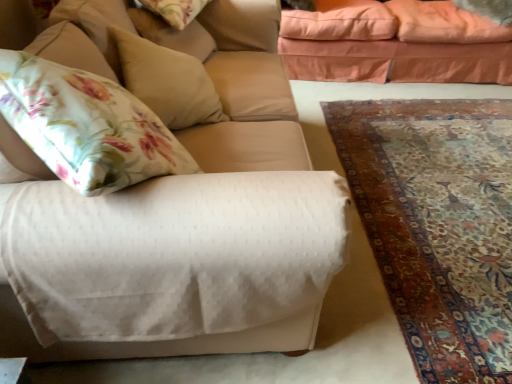
Question: Is floral fabric pillow at upper left, the 3th pillow when ordered from right to left, looking in the opposite direction of fluffy beige pillow at upper right, the first pillow viewed from the top?

Choices:
 (A) yes
 (B) no

Answer: (B)

Question: Considering the relative positions of floral fabric pillow at upper left, which appears as the 1th pillow when viewed from the left, and fluffy beige pillow at upper right, the first pillow viewed from the top, in the image provided, is floral fabric pillow at upper left, which appears as the 1th pillow when viewed from the left, to the left of fluffy beige pillow at upper right, the first pillow viewed from the top, from the viewer's perspective?

Choices:
 (A) no
 (B) yes

Answer: (B)

Question: From the image's perspective, is floral fabric pillow at upper left, which appears as the 1th pillow when viewed from the left, located above fluffy beige pillow at upper right, placed as the third pillow when sorted from left to right?

Choices:
 (A) no
 (B) yes

Answer: (A)

Question: From a real-world perspective, is floral fabric pillow at upper left, which appears as the 1th pillow when viewed from the left, on top of fluffy beige pillow at upper right, which appears as the 3th pillow when viewed from the front?

Choices:
 (A) no
 (B) yes

Answer: (B)

Question: Does floral fabric pillow at upper left, marked as the second pillow in a front-to-back arrangement, have a lesser width compared to fluffy beige pillow at upper right, which is the first pillow in right-to-left order?

Choices:
 (A) yes
 (B) no

Answer: (A)

Question: Can you confirm if floral fabric pillow at upper left, positioned as the second pillow in bottom-to-top order, is taller than fluffy beige pillow at upper right, positioned as the 3th pillow in bottom-to-top order?

Choices:
 (A) yes
 (B) no

Answer: (B)

Question: Is floral fabric pillow at upper left, positioned as the second pillow in bottom-to-top order, not close to carpet with intricate patterns at lower right?

Choices:
 (A) no
 (B) yes

Answer: (B)

Question: Is floral fabric pillow at upper left, marked as the second pillow in a front-to-back arrangement, positioned with its back to carpet with intricate patterns at lower right?

Choices:
 (A) no
 (B) yes

Answer: (A)

Question: From the image's perspective, is floral fabric pillow at upper left, which is the 2th pillow in top-to-bottom order, located above carpet with intricate patterns at lower right?

Choices:
 (A) no
 (B) yes

Answer: (B)

Question: Does floral fabric pillow at upper left, positioned as the second pillow in bottom-to-top order, have a lesser width compared to carpet with intricate patterns at lower right?

Choices:
 (A) no
 (B) yes

Answer: (B)

Question: Is the depth of floral fabric pillow at upper left, which appears as the 1th pillow when viewed from the left, less than that of carpet with intricate patterns at lower right?

Choices:
 (A) yes
 (B) no

Answer: (B)

Question: Is floral fabric pillow at upper left, which is the 2th pillow in top-to-bottom order, next to carpet with intricate patterns at lower right?

Choices:
 (A) no
 (B) yes

Answer: (A)

Question: From the image's perspective, is carpet with intricate patterns at lower right under white textured fabric couch at center, which is the 1th studio couch from front to back?

Choices:
 (A) yes
 (B) no

Answer: (A)